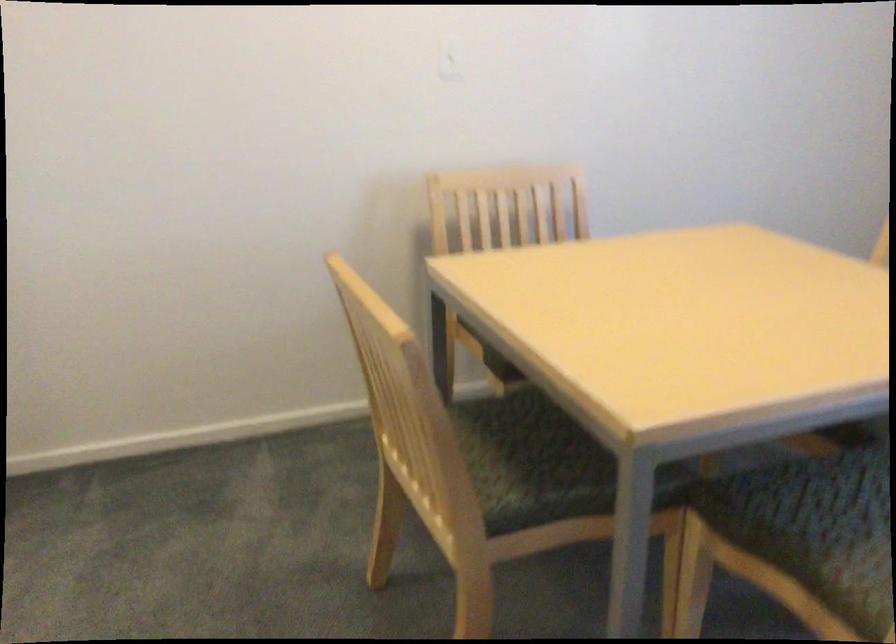
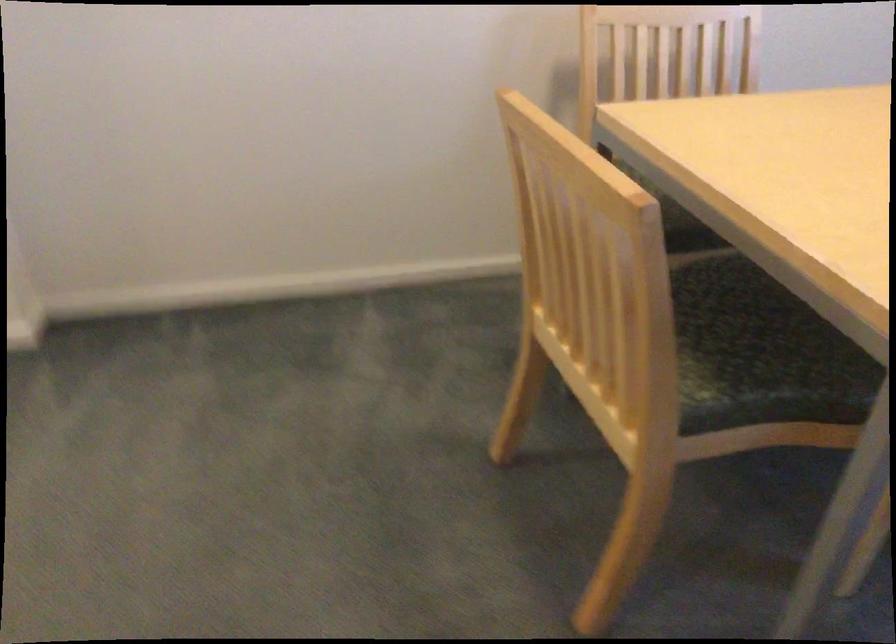
The images are taken continuously from a first-person perspective. In which direction are you moving?

The cameraman moved toward left, forward.